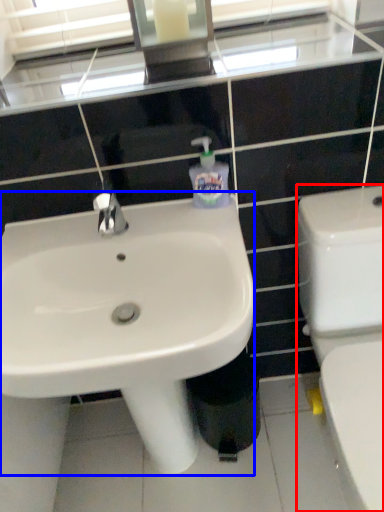
Question: Which of the following is the farthest to the observer, toilet (highlighted by a red box) or sink (highlighted by a blue box)?

Choices:
 (A) toilet
 (B) sink

Answer: (B)